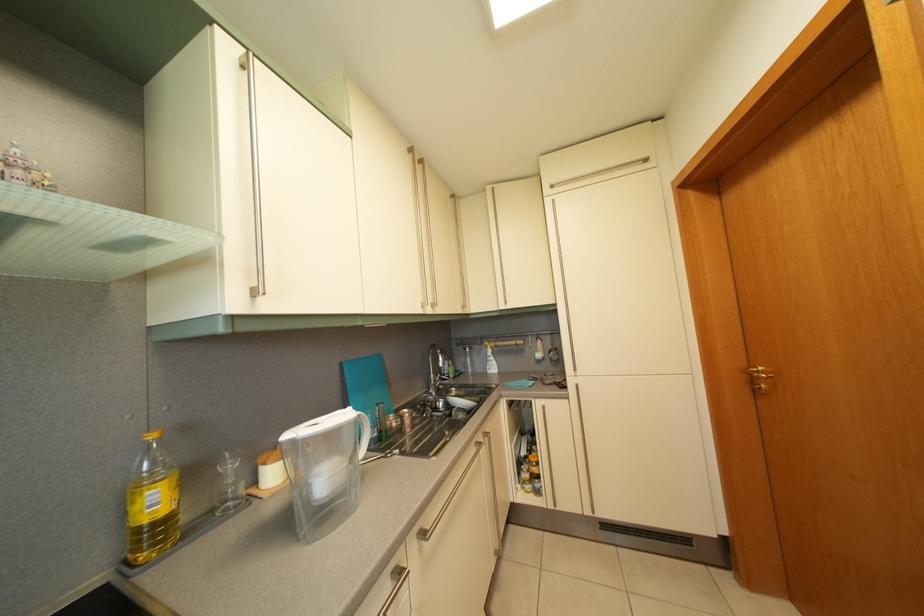
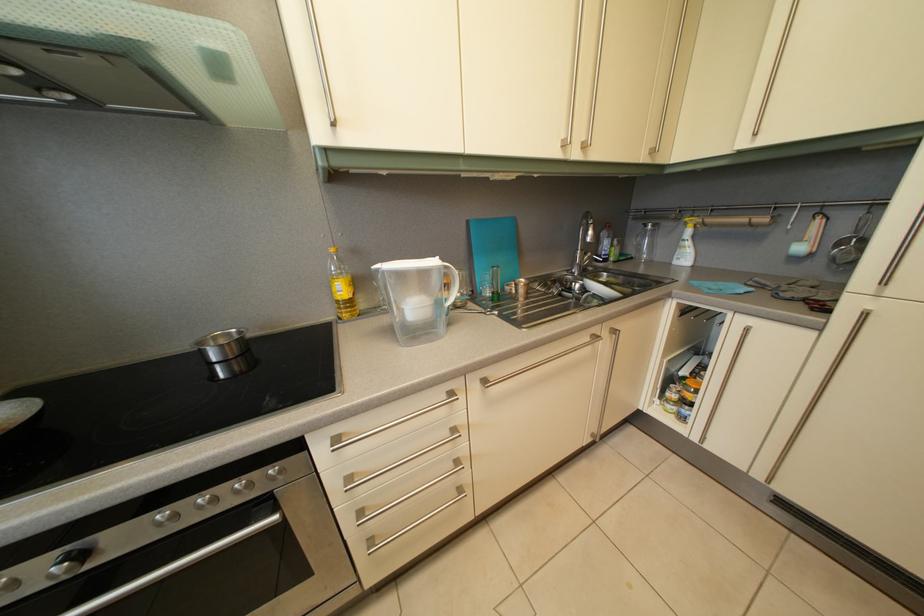
In the second image, find the point that corresponds to [359,416] in the first image.

(445, 265)